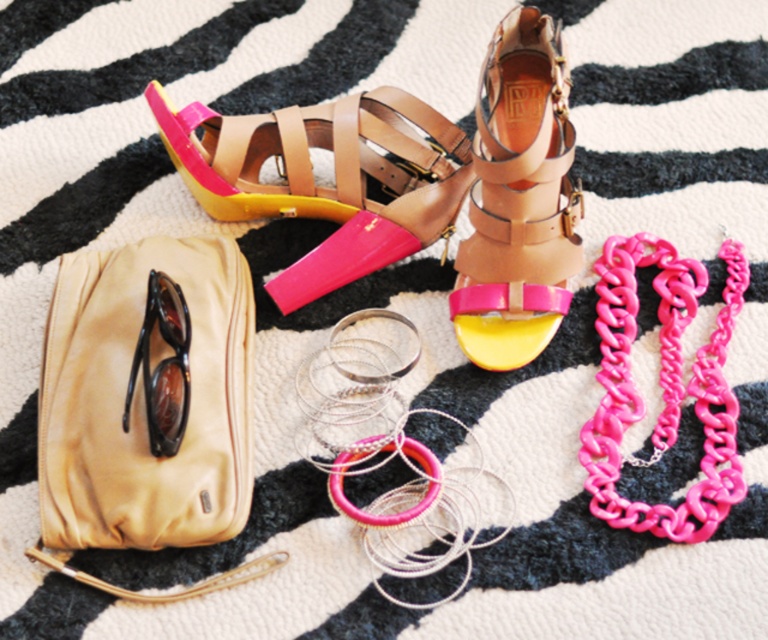
Question: Does pink matte leather sandal at center appear over tan leather sandal at center?

Choices:
 (A) yes
 (B) no

Answer: (A)

Question: Does tan leather bag at left lie behind tan leather sandal at center?

Choices:
 (A) no
 (B) yes

Answer: (A)

Question: Which point is farther to the camera?

Choices:
 (A) (508, 160)
 (B) (161, 118)
 (C) (181, 470)
 (D) (151, 342)

Answer: (B)

Question: Among these points, which one is nearest to the camera?

Choices:
 (A) (416, 198)
 (B) (176, 406)
 (C) (535, 77)

Answer: (B)

Question: Which point is closer to the camera?

Choices:
 (A) (533, 112)
 (B) (379, 131)
 (C) (113, 465)
 (D) (134, 378)

Answer: (C)

Question: Does tan leather bag at left have a lesser width compared to tan leather sandal at center?

Choices:
 (A) yes
 (B) no

Answer: (B)